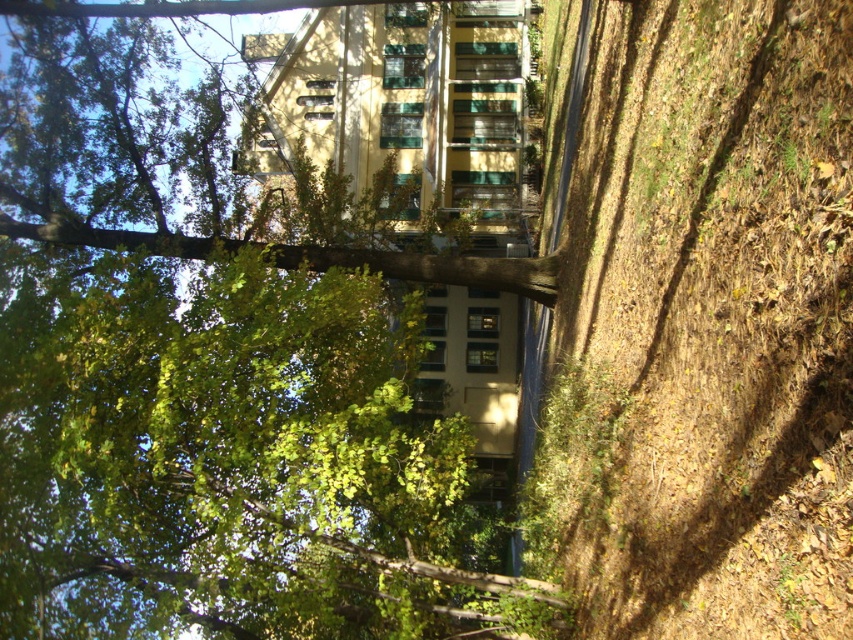
Question: Observing the image, what is the correct spatial positioning of green leafy tree at center in reference to brown dirt at lower right?

Choices:
 (A) left
 (B) right

Answer: (A)

Question: From the image, what is the correct spatial relationship of green leafy tree at center in relation to brown dirt at lower right?

Choices:
 (A) below
 (B) above

Answer: (A)

Question: Which point is closer to the camera taking this photo?

Choices:
 (A) [x=775, y=368]
 (B) [x=19, y=131]

Answer: (A)

Question: Is green leafy tree at center above brown dirt at lower right?

Choices:
 (A) yes
 (B) no

Answer: (B)